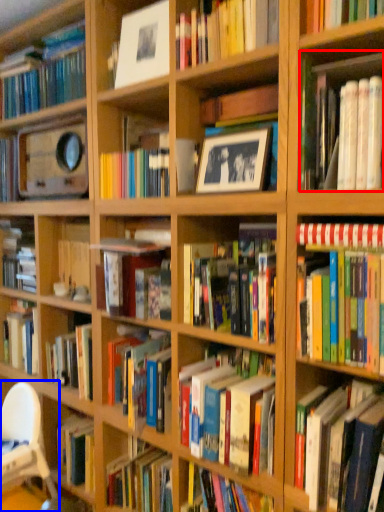
Question: Among these objects, which one is farthest to the camera, book (highlighted by a red box) or chair (highlighted by a blue box)?

Choices:
 (A) book
 (B) chair

Answer: (B)